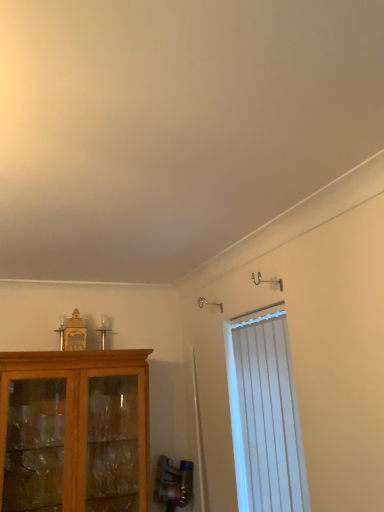
Question: From the image's perspective, is matte wood cabinet at left located above or below white vertical blinds at right?

Choices:
 (A) below
 (B) above

Answer: (A)

Question: Does point (137, 459) appear closer or farther from the camera than point (248, 489)?

Choices:
 (A) farther
 (B) closer

Answer: (A)

Question: Choose the correct answer: Is matte wood cabinet at left inside white vertical blinds at right or outside it?

Choices:
 (A) outside
 (B) inside

Answer: (A)

Question: Is white vertical blinds at right in front of or behind matte wood cabinet at left in the image?

Choices:
 (A) behind
 (B) front

Answer: (B)

Question: Considering the positions of point (236, 375) and point (91, 420), is point (236, 375) closer or farther from the camera than point (91, 420)?

Choices:
 (A) farther
 (B) closer

Answer: (B)

Question: From a real-world perspective, relative to matte wood cabinet at left, is white vertical blinds at right vertically above or below?

Choices:
 (A) above
 (B) below

Answer: (A)

Question: Is white vertical blinds at right bigger or smaller than matte wood cabinet at left?

Choices:
 (A) small
 (B) big

Answer: (A)